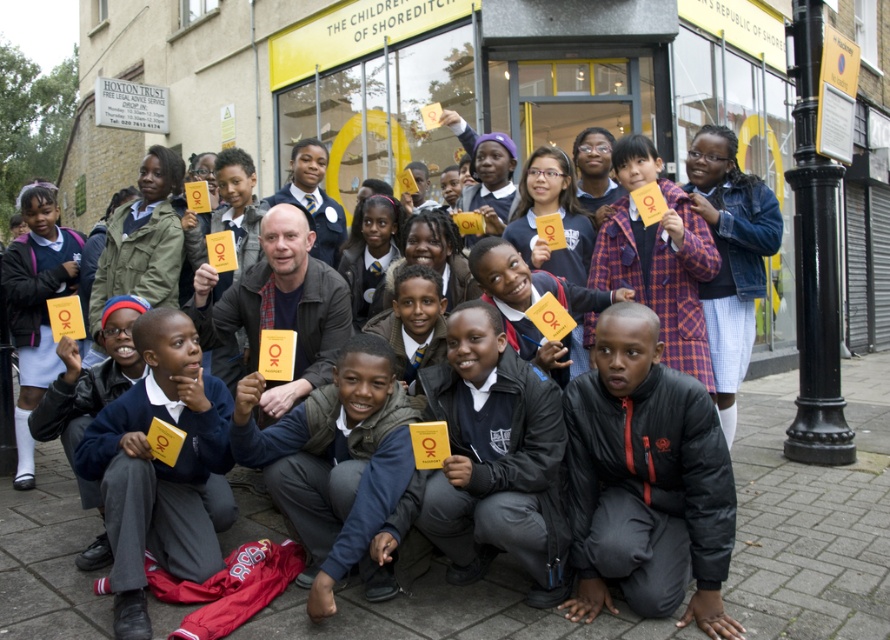
You are a photographer trying to adjust the camera angle to capture both the black matte jacket at lower center and the matte blue uniform at lower left in the same frame. Based on their positions, which object should you focus on first to ensure both are in the frame?

The black matte jacket at lower center has a greater height compared to the matte blue uniform at lower left. To ensure both are in the frame, focus on the black matte jacket at lower center first as it is taller and will require more space vertically.

You are a photographer trying to capture a clear shot of the matte blue uniform at lower left and the matte yellow card at center. Which object should you focus on first if you want to ensure both are in focus without adjusting the camera settings?

The matte blue uniform at lower left is larger in size than the matte yellow card at center, so focusing on the larger matte blue uniform at lower left first would help ensure both are in focus since it requires less precise focus due to its size.